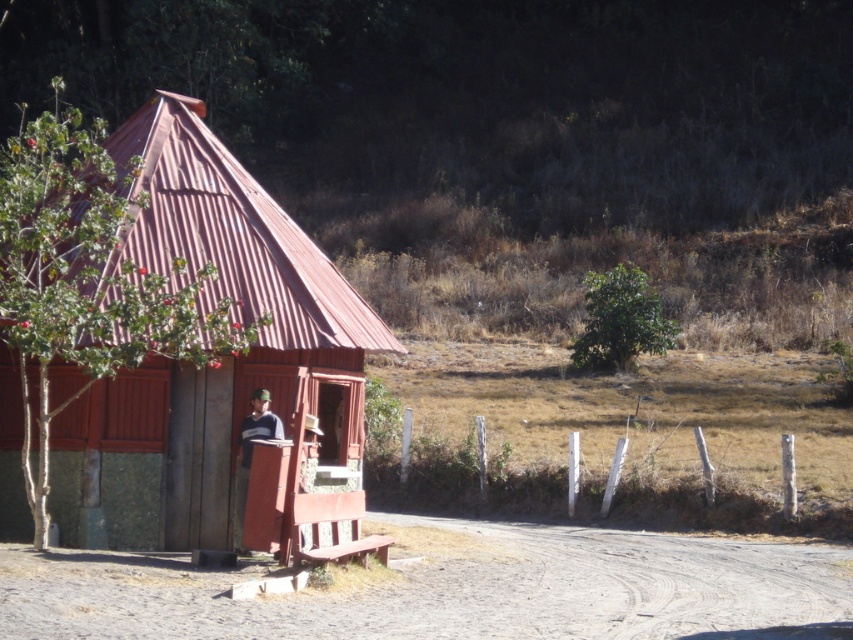
Who is more forward, (332, 401) or (764, 627)?

Point (764, 627) is in front.

Does rustic wood cabin at left appear on the left side of dirt track at lower center?

Correct, you'll find rustic wood cabin at left to the left of dirt track at lower center.

Describe the element at coordinates (207, 365) in the screenshot. I see `rustic wood cabin at left` at that location.

Locate an element on the screen. Image resolution: width=853 pixels, height=640 pixels. rustic wood cabin at left is located at coordinates (207, 365).